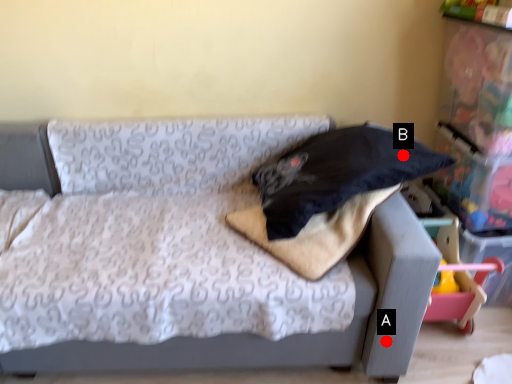
Question: Two points are circled on the image, labeled by A and B beside each circle. Which point appears closest to the camera in this image?

Choices:
 (A) A is closer
 (B) B is closer

Answer: (A)